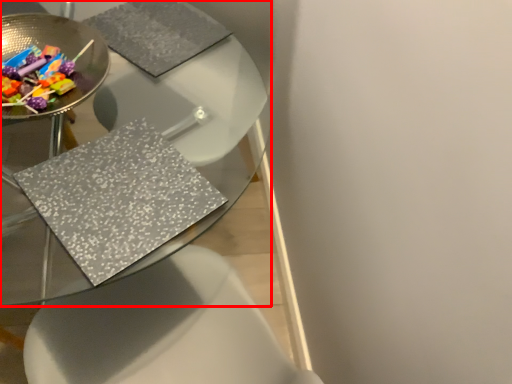
Question: From the image, what is the correct spatial relationship of table (annotated by the red box) in relation to glass plate?

Choices:
 (A) left
 (B) right

Answer: (A)